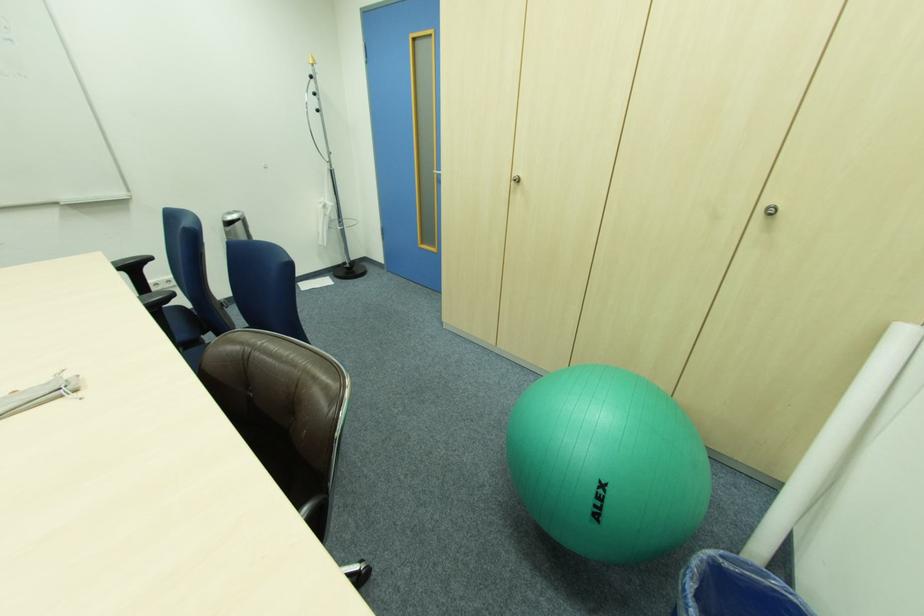
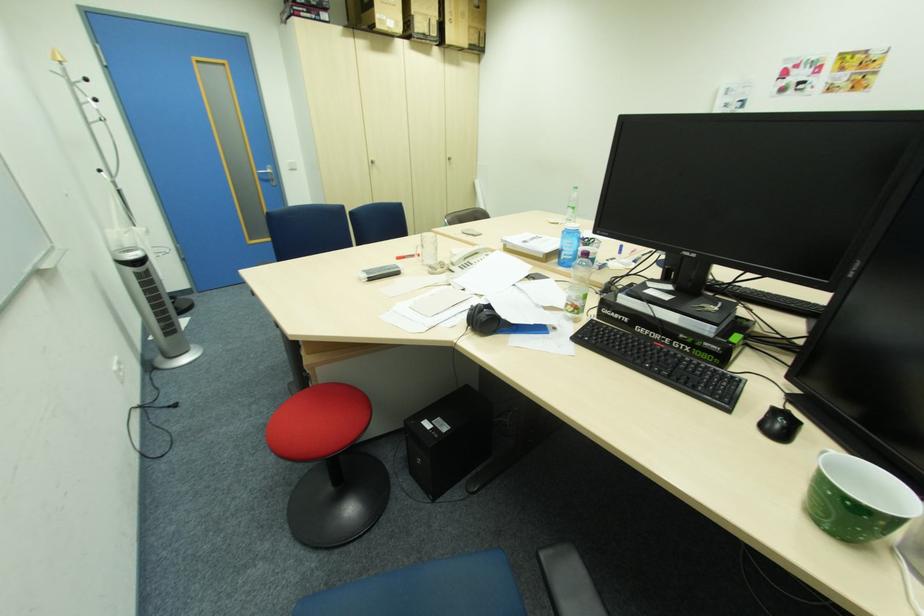
Locate, in the second image, the point that corresponds to [442,175] in the first image.

(264, 174)